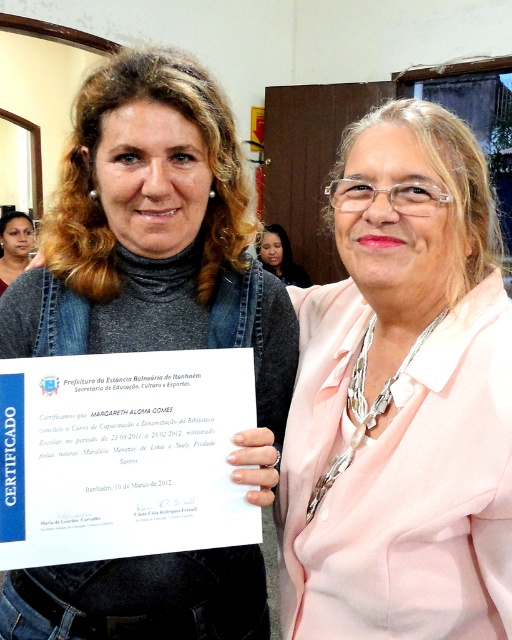
Question: Which of the following is the closest to the observer?

Choices:
 (A) matte gray turtleneck sweater at center
 (B) pink satin blazer at center
 (C) matte black hair at center
 (D) matte black hair at left

Answer: (B)

Question: Which point is closer to the camera?

Choices:
 (A) matte black hair at left
 (B) matte gray turtleneck sweater at center

Answer: (B)

Question: Is pink satin blazer at center in front of matte black hair at center?

Choices:
 (A) no
 (B) yes

Answer: (B)

Question: Does pink satin blazer at center appear on the right side of matte gray turtleneck sweater at center?

Choices:
 (A) yes
 (B) no

Answer: (A)

Question: Can you confirm if matte gray turtleneck sweater at center is wider than matte black hair at left?

Choices:
 (A) yes
 (B) no

Answer: (A)

Question: Which of the following is the farthest from the observer?

Choices:
 (A) (27, 236)
 (B) (426, 364)
 (C) (309, 280)

Answer: (C)